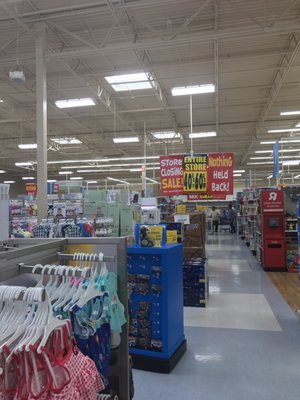
Identify the location of wood floor. This screenshot has height=400, width=300. (291, 286).